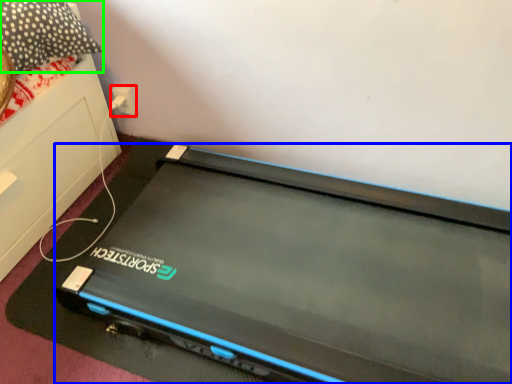
Question: Based on their relative distances, which object is farther from electric outlet (highlighted by a red box)? Choose from computer (highlighted by a blue box) and pillow (highlighted by a green box).

Choices:
 (A) computer
 (B) pillow

Answer: (A)